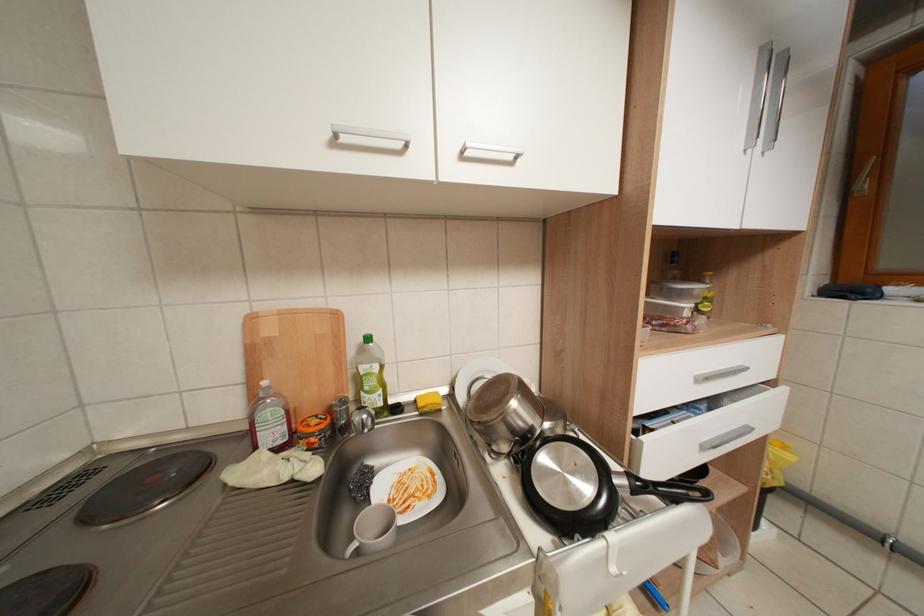
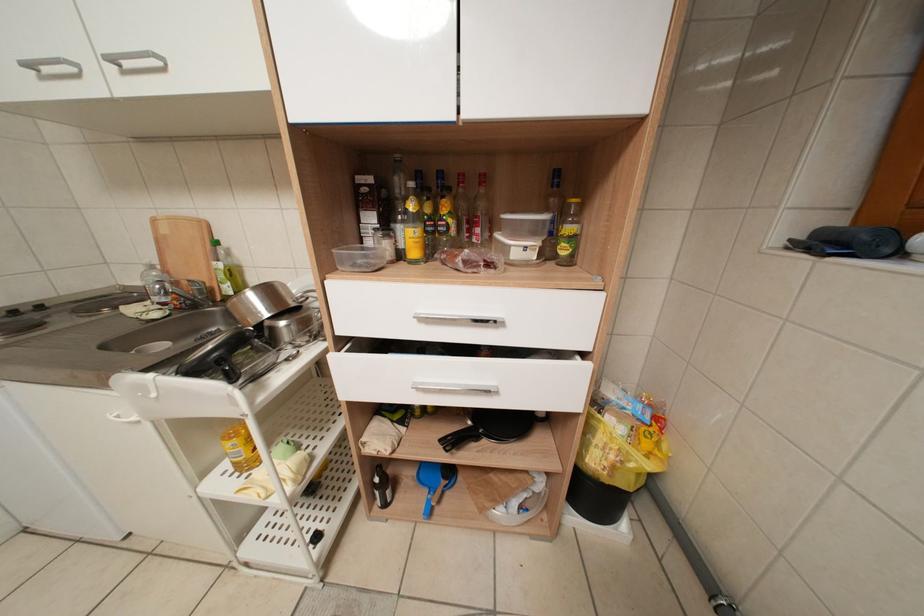
Question: Which direction would the cameraman need to move to produce the second image? Reply with the corresponding letter.

Choices:
 (A) Left
 (B) Right
 (C) Forward
 (D) Backward

Answer: (B)